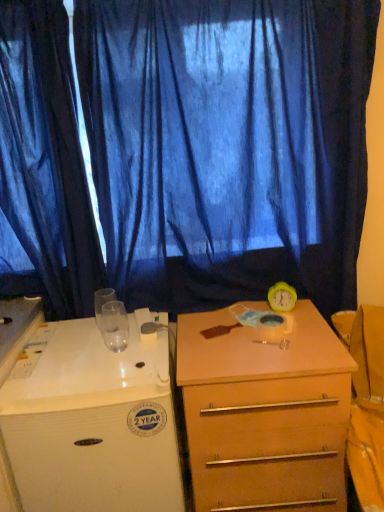
What are the coordinates of `empty space that is ontop of light brown wood drawer at center (from a real-world perspective)` in the screenshot? It's located at pyautogui.click(x=244, y=334).